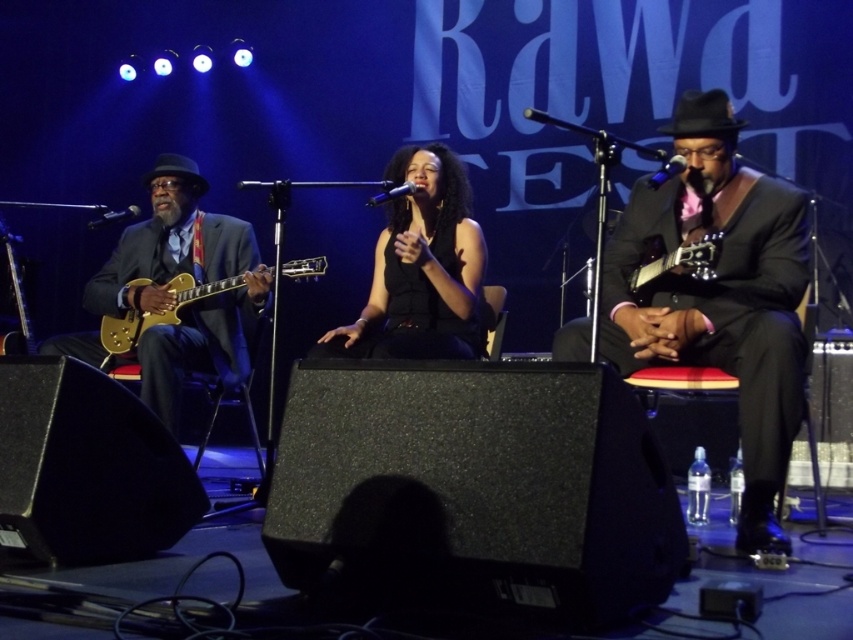
Does point (631, 285) lie behind point (683, 170)?

That is True.

Is glossy wood guitar at right positioned behind metallic blue microphone at center?

Yes, it is behind metallic blue microphone at center.

Find the location of a particular element. The image size is (853, 640). glossy wood guitar at right is located at coordinates (682, 260).

Is metallic blue microphone at center thinner than black metallic microphone at center?

Indeed, metallic blue microphone at center has a lesser width compared to black metallic microphone at center.

Between metallic blue microphone at center and black metallic microphone at center, which one has more height?

Standing taller between the two is black metallic microphone at center.

Image resolution: width=853 pixels, height=640 pixels. What do you see at coordinates (666, 170) in the screenshot?
I see `metallic blue microphone at center` at bounding box center [666, 170].

Locate an element on the screen. metallic blue microphone at center is located at coordinates (666, 170).

Is shiny black suit at center smaller than black matte dress at center?

Incorrect, shiny black suit at center is not smaller in size than black matte dress at center.

Which is below, shiny black suit at center or black matte dress at center?

Positioned lower is shiny black suit at center.

Where is `shiny black suit at center`? shiny black suit at center is located at coordinates (718, 294).